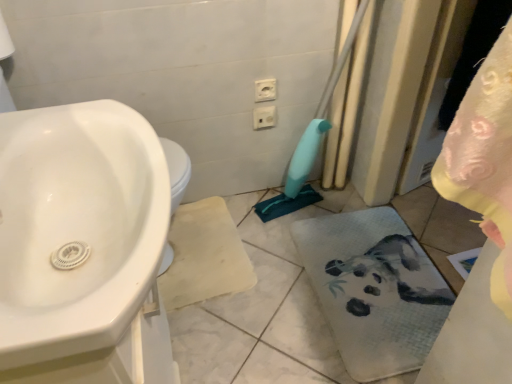
In order to face white plastic electric outlet at upper center, acting as the second electric outlet starting from the back, should I rotate leftwards or rightwards?

Turn right by 1.410 degrees to look at white plastic electric outlet at upper center, acting as the second electric outlet starting from the back.

What are the coordinates of `white plastic electric outlet at upper center, which is the second electric outlet in front-to-back order` in the screenshot? It's located at (264, 117).

From a real-world perspective, who is located higher, white glossy sink at left or white plastic electric outlet at upper center, the second electric outlet positioned from the top?

white glossy sink at left, from a real-world perspective.

From the image's perspective, between white glossy sink at left and white plastic electric outlet at upper center, which is the 1th electric outlet from bottom to top, which one is located above?

white plastic electric outlet at upper center, which is the 1th electric outlet from bottom to top, from the image's perspective.

Is white glossy sink at left beside white plastic electric outlet at upper center, the second electric outlet positioned from the top?

No.

Which is behind, point (50, 119) or point (270, 120)?

The point (270, 120) is farther from the camera.

Who is taller, white plastic electric outlet at upper center, the first electric outlet viewed from the front, or white plastic electric outlet at upper center, the second electric outlet positioned from the top?

Standing taller between the two is white plastic electric outlet at upper center, the second electric outlet positioned from the top.

Based on the photo, is white plastic electric outlet at upper center, the 2th electric outlet from the bottom, wider than white plastic electric outlet at upper center, positioned as the 1th electric outlet in back-to-front order?

Incorrect, the width of white plastic electric outlet at upper center, the 2th electric outlet from the bottom, does not surpass that of white plastic electric outlet at upper center, positioned as the 1th electric outlet in back-to-front order.

Does white plastic electric outlet at upper center, the 2th electric outlet from the bottom, contain white plastic electric outlet at upper center, positioned as the 1th electric outlet in back-to-front order?

Actually, white plastic electric outlet at upper center, positioned as the 1th electric outlet in back-to-front order, is outside white plastic electric outlet at upper center, the 2th electric outlet from the bottom.

Which is more to the left, white plastic electric outlet at upper center, the 2th electric outlet from the bottom, or white plastic electric outlet at upper center, the second electric outlet positioned from the top?

From the viewer's perspective, white plastic electric outlet at upper center, the 2th electric outlet from the bottom, appears more on the left side.

Which of these two, white plastic electric outlet at upper center, the 2th electric outlet from the bottom, or white fabric bath towel at lower right, is thinner?

white plastic electric outlet at upper center, the 2th electric outlet from the bottom.

Between white plastic electric outlet at upper center, the 2th electric outlet from the bottom, and white fabric bath towel at lower right, which one is positioned behind?

white plastic electric outlet at upper center, the 2th electric outlet from the bottom.

Which is closer to the camera, (266,84) or (397,348)?

Point (266,84) is farther from the camera than point (397,348).

From the image's perspective, is white plastic electric outlet at upper center, which appears as the 1th electric outlet when viewed from the top, positioned above or below white fabric bath towel at lower right?

From the image's perspective, white plastic electric outlet at upper center, which appears as the 1th electric outlet when viewed from the top, appears above white fabric bath towel at lower right.

Does white fabric bath towel at lower right contain white plastic electric outlet at upper center, the 2th electric outlet from the bottom?

No, white plastic electric outlet at upper center, the 2th electric outlet from the bottom, is not a part of white fabric bath towel at lower right.

Considering the relative sizes of white fabric bath towel at lower right and white plastic electric outlet at upper center, the 2th electric outlet from the bottom, in the image provided, is white fabric bath towel at lower right wider than white plastic electric outlet at upper center, the 2th electric outlet from the bottom,?

Yes.

Considering the relative positions of white fabric bath towel at lower right and white plastic electric outlet at upper center, the 2th electric outlet from the bottom, in the image provided, is white fabric bath towel at lower right to the left or to the right of white plastic electric outlet at upper center, the 2th electric outlet from the bottom,?

white fabric bath towel at lower right is to the right of white plastic electric outlet at upper center, the 2th electric outlet from the bottom.

Who is taller, white fabric bath towel at lower right or white plastic electric outlet at upper center, which appears as the 1th electric outlet when viewed from the top?

With more height is white plastic electric outlet at upper center, which appears as the 1th electric outlet when viewed from the top.

Looking at the image, does white glossy sink at left seem bigger or smaller compared to white fabric bath towel at lower right?

white glossy sink at left is bigger than white fabric bath towel at lower right.

Could you tell me if white glossy sink at left is turned towards white fabric bath towel at lower right?

No.

Does white glossy sink at left come in front of white fabric bath towel at lower right?

That is True.

Does white plastic electric outlet at upper center, which is the second electric outlet in front-to-back order, have a larger size compared to white plastic electric outlet at upper center, the 2th electric outlet from the bottom?

Yes.

Can you tell me how much white plastic electric outlet at upper center, the second electric outlet positioned from the top, and white plastic electric outlet at upper center, acting as the second electric outlet starting from the back, differ in facing direction?

0.000683 degrees separate the facing orientations of white plastic electric outlet at upper center, the second electric outlet positioned from the top, and white plastic electric outlet at upper center, acting as the second electric outlet starting from the back.

Between white plastic electric outlet at upper center, which is the 1th electric outlet from bottom to top, and white plastic electric outlet at upper center, the 2th electric outlet from the bottom, which one has smaller width?

white plastic electric outlet at upper center, the 2th electric outlet from the bottom.

From the picture: From the image's perspective, between white plastic electric outlet at upper center, acting as the second electric outlet starting from the back, and white glossy sink at left, which one is located above?

white plastic electric outlet at upper center, acting as the second electric outlet starting from the back, is shown above in the image.

Find the location of a particular element. sink above the white plastic electric outlet at upper center, the 2th electric outlet from the bottom (from a real-world perspective) is located at coordinates (77, 226).

Which is correct: white plastic electric outlet at upper center, the first electric outlet viewed from the front, is inside white glossy sink at left, or outside of it?

white plastic electric outlet at upper center, the first electric outlet viewed from the front, is spatially situated outside white glossy sink at left.

Is white plastic electric outlet at upper center, the first electric outlet viewed from the front, far away from white glossy sink at left?

white plastic electric outlet at upper center, the first electric outlet viewed from the front, is actually quite close to white glossy sink at left.

Image resolution: width=512 pixels, height=384 pixels. I want to click on sink in front of the white plastic electric outlet at upper center, which is the 1th electric outlet from bottom to top, so click(x=77, y=226).

Where is `electric outlet that appears on the right of white plastic electric outlet at upper center, acting as the second electric outlet starting from the back`? This screenshot has width=512, height=384. electric outlet that appears on the right of white plastic electric outlet at upper center, acting as the second electric outlet starting from the back is located at coordinates (264, 117).

Consider the image. Based on their spatial positions, is white fabric bath towel at lower right or white glossy sink at left closer to white plastic electric outlet at upper center, which appears as the 1th electric outlet when viewed from the top?

Among the two, white fabric bath towel at lower right is located nearer to white plastic electric outlet at upper center, which appears as the 1th electric outlet when viewed from the top.

From the image, which object appears to be farther from white fabric bath towel at lower right, white plastic electric outlet at upper center, the second electric outlet positioned from the top, or white glossy sink at left?

white glossy sink at left lies further to white fabric bath towel at lower right than the other object.

Looking at the image, which one is located closer to white fabric bath towel at lower right, white plastic electric outlet at upper center, positioned as the 1th electric outlet in back-to-front order, or white plastic electric outlet at upper center, the first electric outlet viewed from the front?

The object closer to white fabric bath towel at lower right is white plastic electric outlet at upper center, positioned as the 1th electric outlet in back-to-front order.

Estimate the real-world distances between objects in this image. Which object is closer to white plastic electric outlet at upper center, which is the second electric outlet in front-to-back order, white fabric bath towel at lower right or white glossy sink at left?

Based on the image, white fabric bath towel at lower right appears to be nearer to white plastic electric outlet at upper center, which is the second electric outlet in front-to-back order.

When comparing their distances from white fabric bath towel at lower right, does white glossy sink at left or white plastic electric outlet at upper center, which appears as the 1th electric outlet when viewed from the top, seem closer?

Based on the image, white plastic electric outlet at upper center, which appears as the 1th electric outlet when viewed from the top, appears to be nearer to white fabric bath towel at lower right.

Based on their spatial positions, is white plastic electric outlet at upper center, acting as the second electric outlet starting from the back, or white fabric bath towel at lower right further from white plastic electric outlet at upper center, the second electric outlet positioned from the top?

white fabric bath towel at lower right is further to white plastic electric outlet at upper center, the second electric outlet positioned from the top.

Considering their positions, is white plastic electric outlet at upper center, the 2th electric outlet from the bottom, positioned closer to white fabric bath towel at lower right than white plastic electric outlet at upper center, which is the second electric outlet in front-to-back order?

The object closer to white fabric bath towel at lower right is white plastic electric outlet at upper center, which is the second electric outlet in front-to-back order.

From the image, which object appears to be farther from white plastic electric outlet at upper center, the first electric outlet viewed from the front, white plastic electric outlet at upper center, which is the second electric outlet in front-to-back order, or white fabric bath towel at lower right?

Based on the image, white fabric bath towel at lower right appears to be further to white plastic electric outlet at upper center, the first electric outlet viewed from the front.

At what (x,y) coordinates should I click in order to perform the action: click on bath towel between white glossy sink at left and white plastic electric outlet at upper center, the second electric outlet positioned from the top, from front to back. Please return your answer as a coordinate pair (x, y). Looking at the image, I should click on (374, 289).

This screenshot has height=384, width=512. I want to click on bath towel located between white glossy sink at left and white plastic electric outlet at upper center, acting as the second electric outlet starting from the back, in the depth direction, so click(374, 289).

Identify the location of electric outlet between white plastic electric outlet at upper center, the 2th electric outlet from the bottom, and white fabric bath towel at lower right from top to bottom. The width and height of the screenshot is (512, 384). (264, 117).

Identify the location of electric outlet located between white glossy sink at left and white plastic electric outlet at upper center, which is the second electric outlet in front-to-back order, in the depth direction. (265, 90).